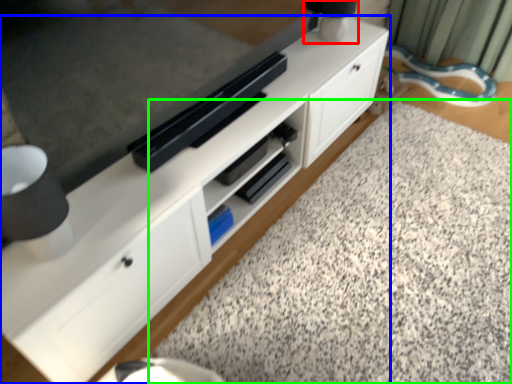
Question: Which object is the farthest from table lamp (highlighted by a red box)? Choose among these: cabinetry (highlighted by a blue box) or granite (highlighted by a green box).

Choices:
 (A) cabinetry
 (B) granite

Answer: (B)